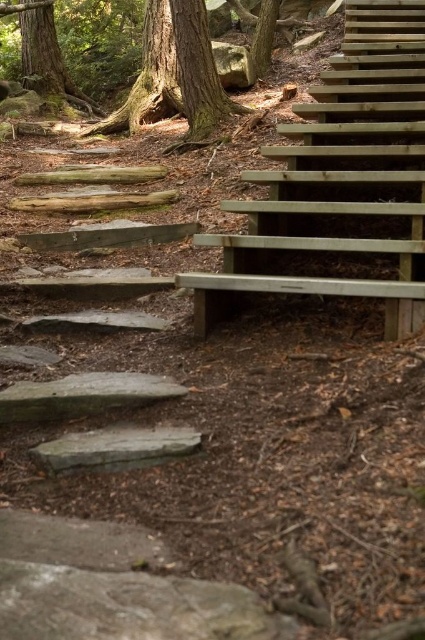
Who is more forward, (413, 156) or (142, 104)?

Positioned in front is point (413, 156).

Between point (329, 60) and point (153, 77), which one is positioned in front?

Point (329, 60) is more forward.

At what (x,y) coordinates should I click in order to perform the action: click on wooden stairs at upper right. Please return your answer as a coordinate pair (x, y). The height and width of the screenshot is (640, 425). Looking at the image, I should click on (340, 180).